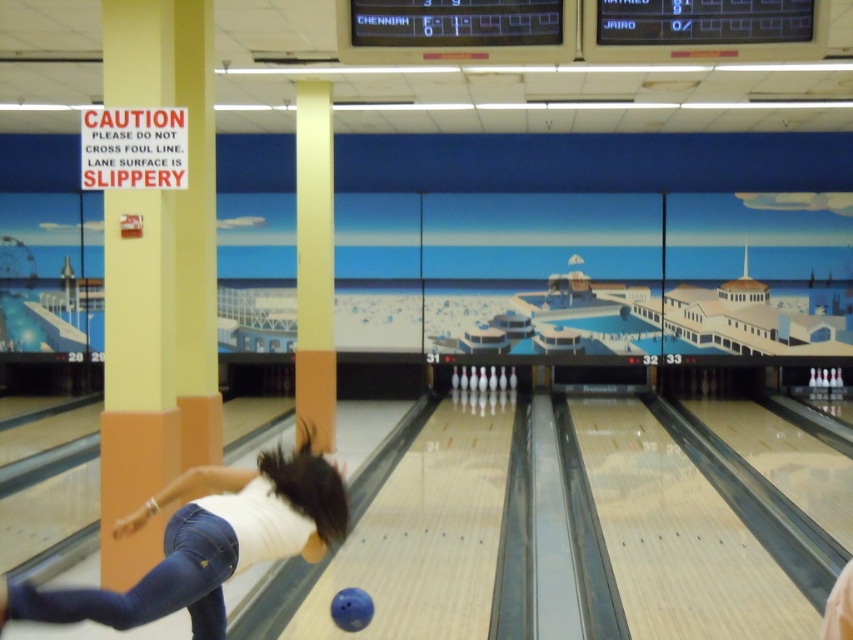
Is white matte shirt at center bigger than blue rubber bowling ball at center?

Yes.

In the scene shown: Who is shorter, white matte shirt at center or blue rubber bowling ball at center?

blue rubber bowling ball at center is shorter.

The height and width of the screenshot is (640, 853). Describe the element at coordinates (207, 541) in the screenshot. I see `white matte shirt at center` at that location.

Find the location of a particular element. The image size is (853, 640). white matte shirt at center is located at coordinates (207, 541).

Is denim at left to the right of blue rubber bowling ball at center from the viewer's perspective?

Incorrect, denim at left is not on the right side of blue rubber bowling ball at center.

In the scene shown: Who is positioned more to the right, denim at left or blue rubber bowling ball at center?

blue rubber bowling ball at center

The height and width of the screenshot is (640, 853). In order to click on denim at left in this screenshot , I will do `click(149, 582)`.

Does white matte shirt at center have a smaller size compared to denim at left?

No, white matte shirt at center is not smaller than denim at left.

Does white matte shirt at center appear on the left side of denim at left?

No, white matte shirt at center is not to the left of denim at left.

Who is more forward, (163,614) or (206,547)?

Point (163,614)

Find the location of `white matte shirt at center`. white matte shirt at center is located at coordinates (207, 541).